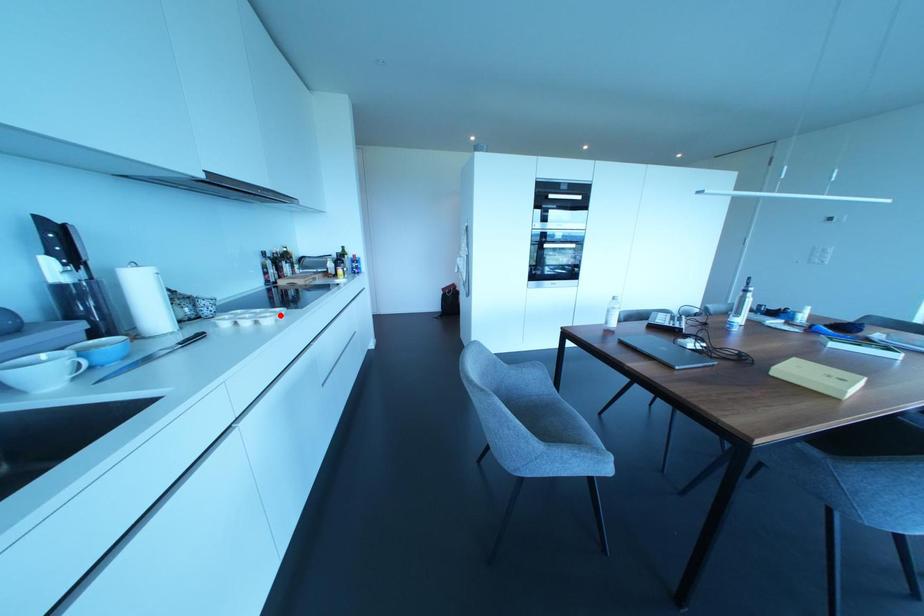
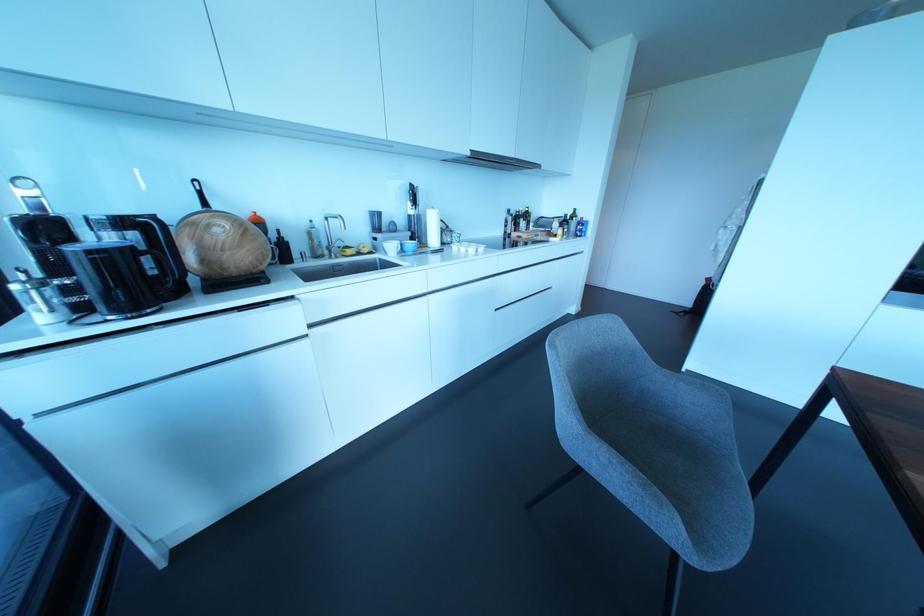
Question: I am providing you with two images of the same scene from different viewpoints. A red point is marked on the first image. At the location where the point appears in image 1, is it still visible in image 2?

Choices:
 (A) Yes
 (B) No

Answer: (A)